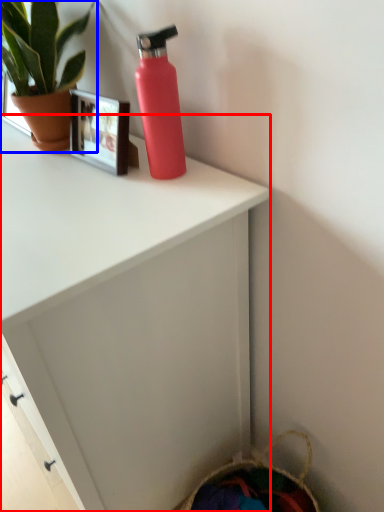
Question: Which object is closer to the camera taking this photo, desk (highlighted by a red box) or houseplant (highlighted by a blue box)?

Choices:
 (A) desk
 (B) houseplant

Answer: (A)